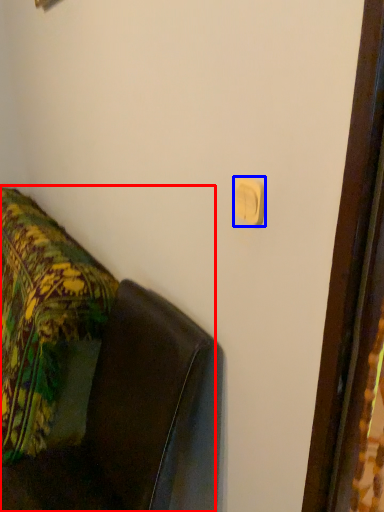
Question: Which of the following is the closest to the observer, furniture (highlighted by a red box) or light switch (highlighted by a blue box)?

Choices:
 (A) furniture
 (B) light switch

Answer: (A)